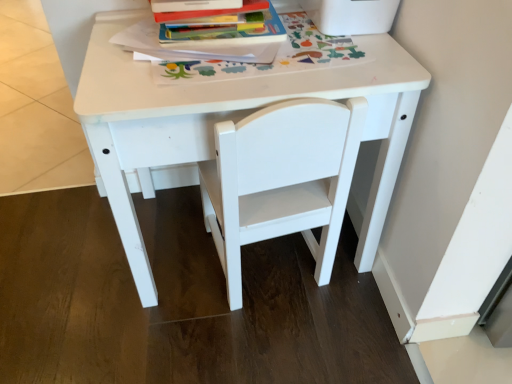
Question: Considering their positions, is hardcover book at upper center located in front of or behind white matte chair at center?

Choices:
 (A) behind
 (B) front

Answer: (A)

Question: In terms of width, does hardcover book at upper center look wider or thinner when compared to white matte chair at center?

Choices:
 (A) wide
 (B) thin

Answer: (B)

Question: Which is nearer to the white matte table at center?

Choices:
 (A) white matte chair at center
 (B) hardcover book at upper center

Answer: (A)

Question: Which object is the farthest from the white matte table at center?

Choices:
 (A) hardcover book at upper center
 (B) white matte chair at center

Answer: (A)